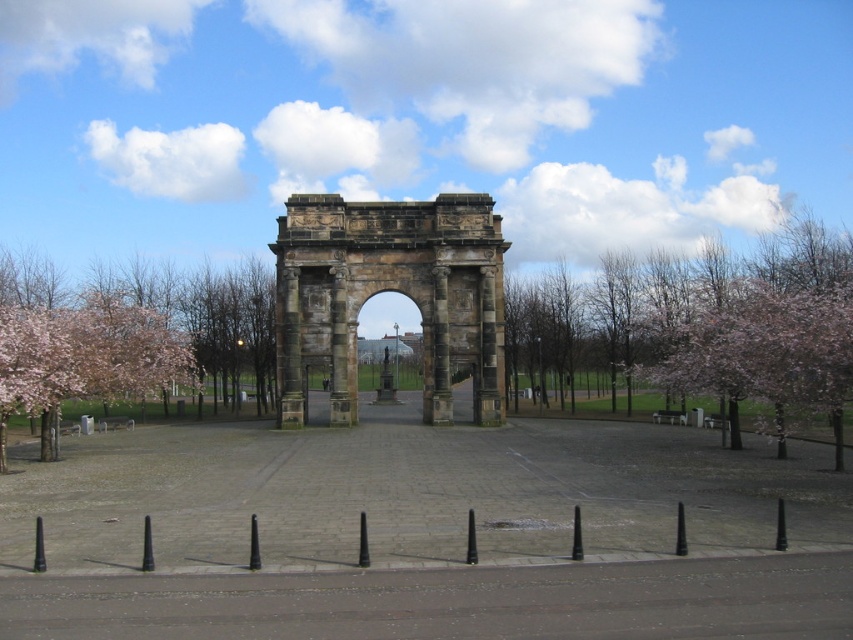
Question: Which object is the farthest from the pink blossoms at left?

Choices:
 (A) pink blossoms at right
 (B) stone archway at center

Answer: (A)

Question: Considering the real-world distances, which object is farthest from the pink blossoms at right?

Choices:
 (A) stone archway at center
 (B) pink blossoms at left

Answer: (B)

Question: Can you confirm if stone archway at center is wider than pink blossoms at left?

Choices:
 (A) yes
 (B) no

Answer: (B)

Question: Among these points, which one is nearest to the camera?

Choices:
 (A) (467, 346)
 (B) (776, 401)
 (C) (181, 300)

Answer: (B)

Question: Is pink blossoms at right to the left of pink blossoms at left from the viewer's perspective?

Choices:
 (A) no
 (B) yes

Answer: (A)

Question: Considering the relative positions of pink blossoms at right and stone archway at center in the image provided, where is pink blossoms at right located with respect to stone archway at center?

Choices:
 (A) above
 (B) below

Answer: (B)